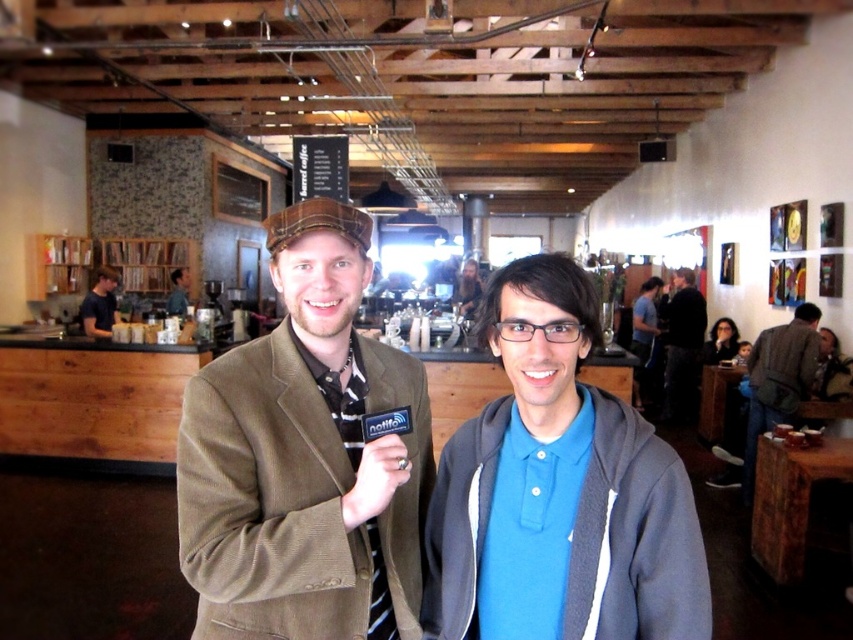
Based on the photo, you are a photographer who needs to move your camera closer to the brown leather backpack at right to capture a better angle. The space between them is 15.50 feet. If you can move 3 feet per second, how long will it take you to reach the backpack?

The distance between the camera and the brown leather backpack at right is 15.50 feet. Moving at 3 feet per second, it would take approximately 5.17 seconds to cover the distance.

You are standing at the entrance of the cafe and want to greet the person with the matte black hair at upper right. The dark blue shirt at left is blocking your path. Is there enough space to walk around them without getting too close?

The dark blue shirt at left is 19.37 feet away from the matte black hair at upper right. Since the distance is relatively large, you can comfortably walk around the dark blue shirt at left to reach the matte black hair at upper right without getting too close.

You are standing in the cafe and notice two points marked in the scene. The first is point at (653, 333) and the second is point at (115, 308). Which point is closer to you?

Point at (653, 333) is closer to you because it is further to the viewer than point at (115, 308).